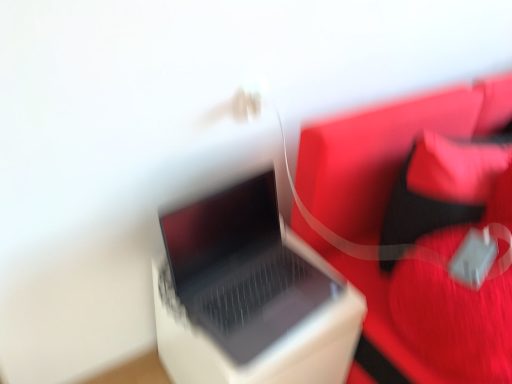
Question: From a real-world perspective, does satin black laptop at center stand above velvet red bean bag chair at right?

Choices:
 (A) no
 (B) yes

Answer: (A)

Question: Is satin black laptop at center completely or partially outside of velvet red bean bag chair at right?

Choices:
 (A) yes
 (B) no

Answer: (A)

Question: From a real-world perspective, is satin black laptop at center located beneath velvet red bean bag chair at right?

Choices:
 (A) no
 (B) yes

Answer: (B)

Question: Does satin black laptop at center have a lesser height compared to velvet red bean bag chair at right?

Choices:
 (A) yes
 (B) no

Answer: (A)

Question: Is satin black laptop at center thinner than velvet red bean bag chair at right?

Choices:
 (A) no
 (B) yes

Answer: (B)

Question: Does satin black laptop at center have a smaller size compared to velvet red bean bag chair at right?

Choices:
 (A) no
 (B) yes

Answer: (B)

Question: Is velvet red bean bag chair at right far from satin black laptop at center?

Choices:
 (A) yes
 (B) no

Answer: (B)

Question: From a real-world perspective, is velvet red bean bag chair at right below satin black laptop at center?

Choices:
 (A) yes
 (B) no

Answer: (B)

Question: Does velvet red bean bag chair at right appear on the right side of satin black laptop at center?

Choices:
 (A) no
 (B) yes

Answer: (B)

Question: From the image's perspective, is velvet red bean bag chair at right beneath satin black laptop at center?

Choices:
 (A) yes
 (B) no

Answer: (B)

Question: Does velvet red bean bag chair at right appear on the left side of satin black laptop at center?

Choices:
 (A) yes
 (B) no

Answer: (B)

Question: Is velvet red bean bag chair at right facing away from satin black laptop at center?

Choices:
 (A) yes
 (B) no

Answer: (B)

Question: Can you confirm if white plastic laptop at center is positioned to the left of rubberized red bag at right?

Choices:
 (A) no
 (B) yes

Answer: (B)